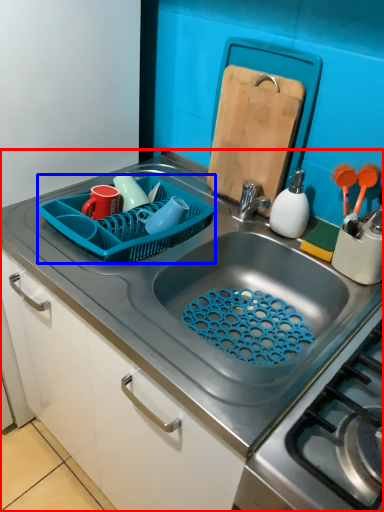
Question: Which point is further to the camera, countertop (highlighted by a red box) or basket (highlighted by a blue box)?

Choices:
 (A) countertop
 (B) basket

Answer: (B)